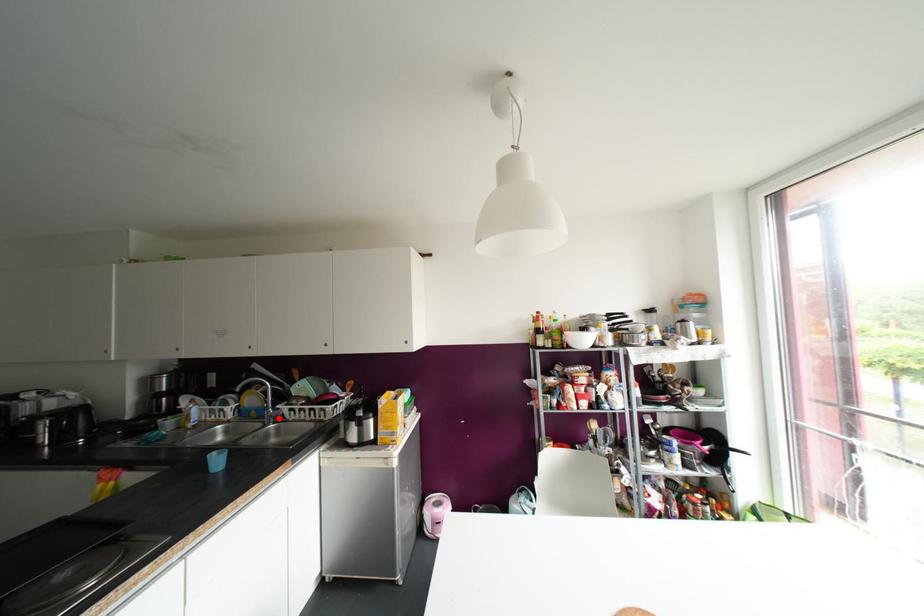
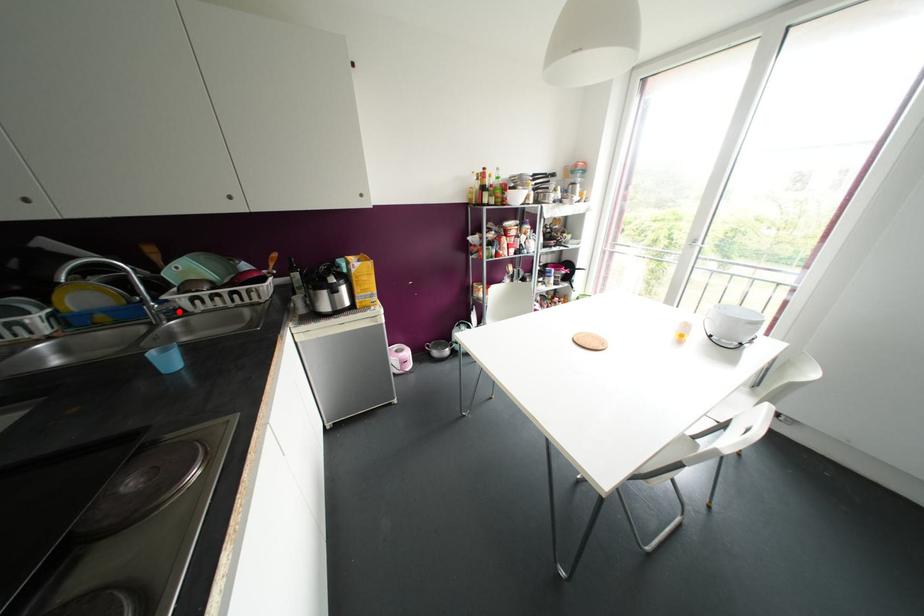
I am providing you with two images of the same scene from different viewpoints. A red point is marked on the first image and another point is marked on the second image. Does the point marked in image1 correspond to the same location as the one in image2?

Yes